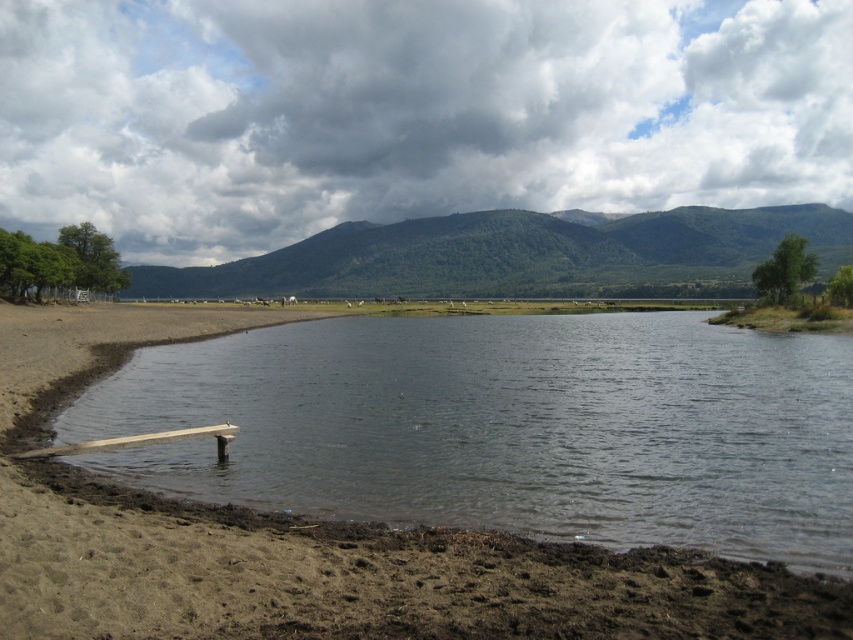
Between brown sandy beach at lower left and green forested mountain at center, which one appears on the right side from the viewer's perspective?

green forested mountain at center is more to the right.

Which is more to the left, brown sandy beach at lower left or green forested mountain at center?

From the viewer's perspective, brown sandy beach at lower left appears more on the left side.

Is point (311, 531) closer to viewer compared to point (666, 241)?

That is True.

Identify the location of brown sandy beach at lower left. (312, 540).